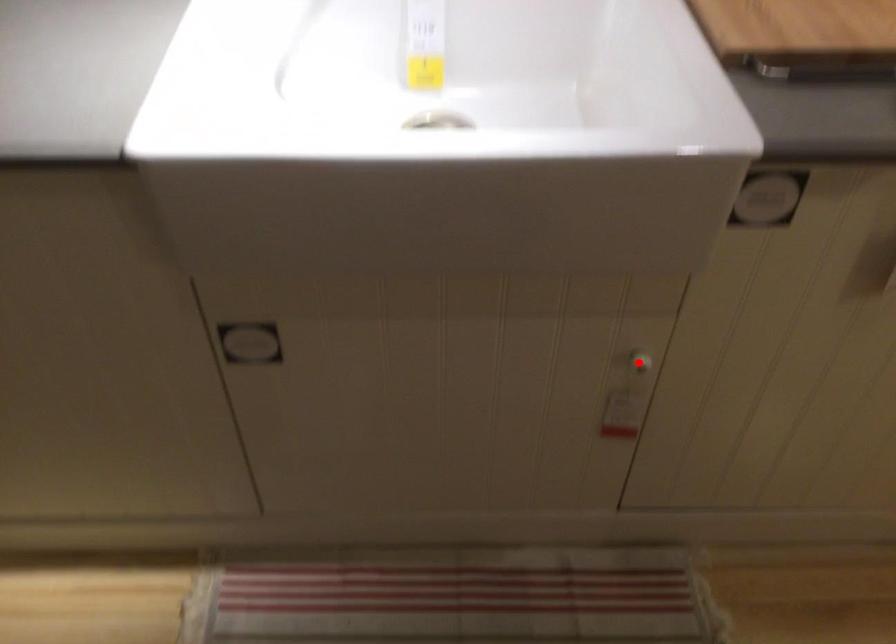
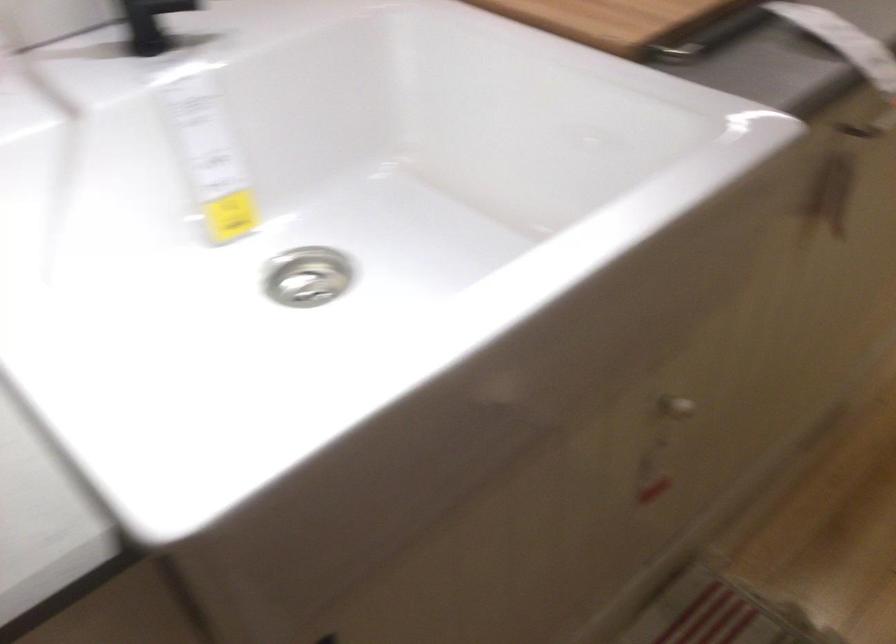
Question: I am providing you with two images of the same scene from different viewpoints. In image1, a red point is highlighted. Considering the same 3D point in image2, which of the following is correct?

Choices:
 (A) It is closer
 (B) It is farther

Answer: (A)